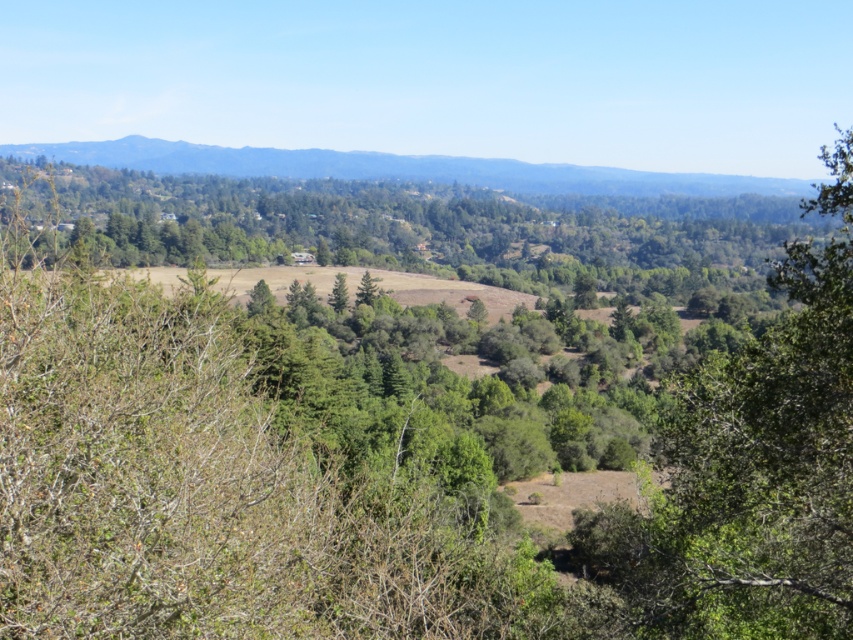
Question: Which point appears closest to the camera in this image?

Choices:
 (A) 683,179
 (B) 380,237

Answer: (B)

Question: Is green leafy tree at center wider than green forested mountain at upper center?

Choices:
 (A) no
 (B) yes

Answer: (A)

Question: Is green leafy tree at center smaller than green forested mountain at upper center?

Choices:
 (A) no
 (B) yes

Answer: (A)

Question: Among these points, which one is farthest from the camera?

Choices:
 (A) (544, 163)
 (B) (500, 232)

Answer: (A)

Question: Does green leafy tree at center have a larger size compared to green forested mountain at upper center?

Choices:
 (A) yes
 (B) no

Answer: (A)